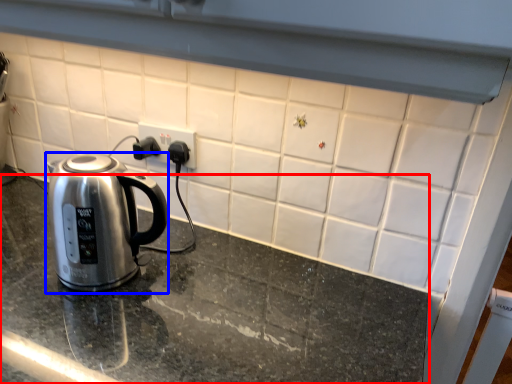
Question: Which of the following is the closest to the observer, table top (highlighted by a red box) or kettle (highlighted by a blue box)?

Choices:
 (A) table top
 (B) kettle

Answer: (A)